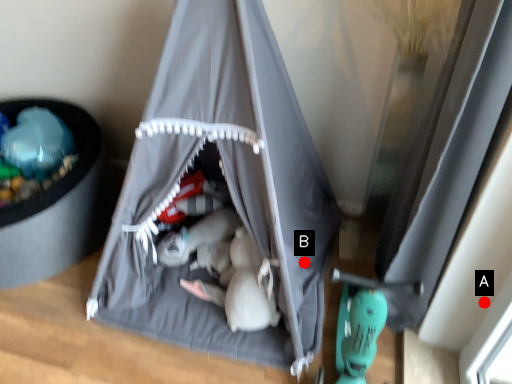
Question: Two points are circled on the image, labeled by A and B beside each circle. Which point is closer to the camera?

Choices:
 (A) A is closer
 (B) B is closer

Answer: (A)